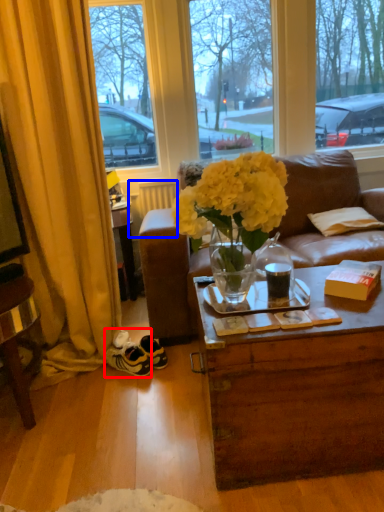
Question: Which point is further to the camera, sneakers (highlighted by a red box) or radiator (highlighted by a blue box)?

Choices:
 (A) sneakers
 (B) radiator

Answer: (B)